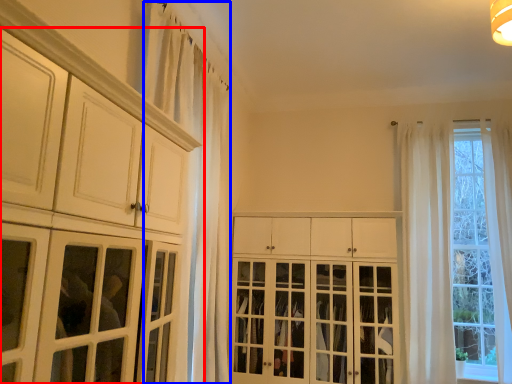
Question: Which object is further to the camera taking this photo, cabinetry (highlighted by a red box) or curtain (highlighted by a blue box)?

Choices:
 (A) cabinetry
 (B) curtain

Answer: (B)